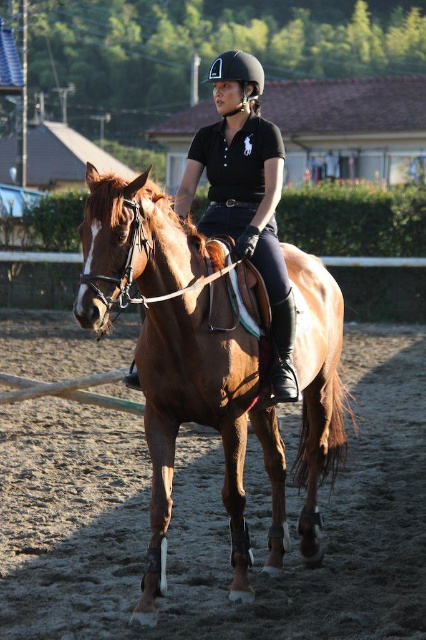
Question: Can you confirm if brown glossy horse at center is positioned to the right of black matte helmet at center?

Choices:
 (A) yes
 (B) no

Answer: (A)

Question: Is brown glossy horse at center thinner than black matte helmet at center?

Choices:
 (A) yes
 (B) no

Answer: (B)

Question: Among these points, which one is farthest from the camera?

Choices:
 (A) (141, 204)
 (B) (261, 81)

Answer: (B)

Question: Which point is farther to the camera?

Choices:
 (A) (233, 61)
 (B) (141, 200)

Answer: (A)

Question: Observing the image, what is the correct spatial positioning of brown glossy horse at center in reference to black matte helmet at center?

Choices:
 (A) right
 (B) left

Answer: (A)